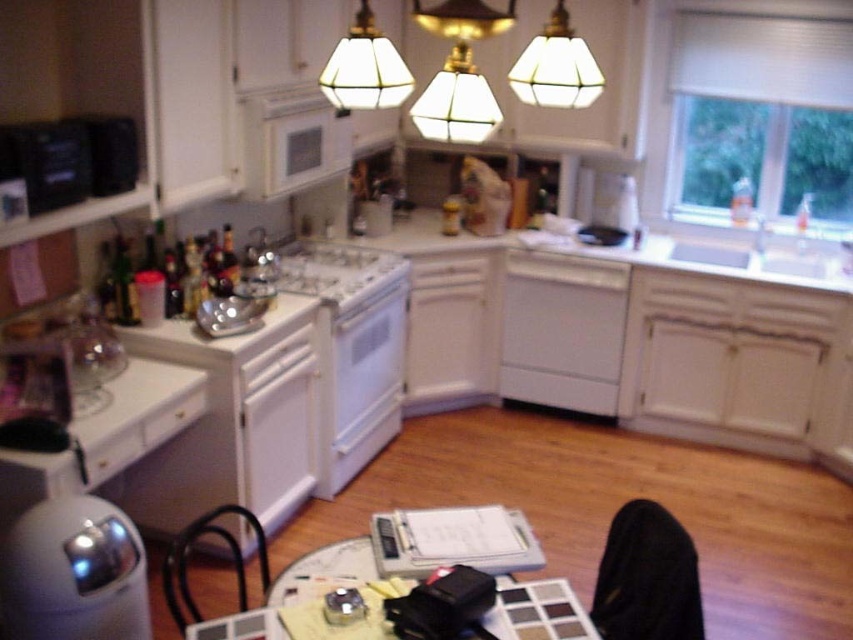
Question: Which of the following is the farthest from the observer?

Choices:
 (A) (637, 250)
 (B) (256, 134)

Answer: (A)

Question: From the image, what is the correct spatial relationship of white matte dishwasher at center in relation to matte plastic table at center?

Choices:
 (A) above
 (B) below

Answer: (A)

Question: Which is nearer to the white matte dishwasher at center?

Choices:
 (A) matte glass lampshade at upper center
 (B) white glossy countertop at center
 (C) translucent glass lampshade at upper center
 (D) matte plastic table at center

Answer: (B)

Question: Which of the following is the farthest from the observer?

Choices:
 (A) (x=389, y=93)
 (B) (x=552, y=76)
 (C) (x=515, y=616)

Answer: (C)

Question: Does white glossy countertop at center have a greater width compared to translucent glass lampshade at upper center?

Choices:
 (A) no
 (B) yes

Answer: (B)

Question: Does white plastic clipboard at center have a lesser width compared to white glossy microwave at upper center?

Choices:
 (A) no
 (B) yes

Answer: (A)